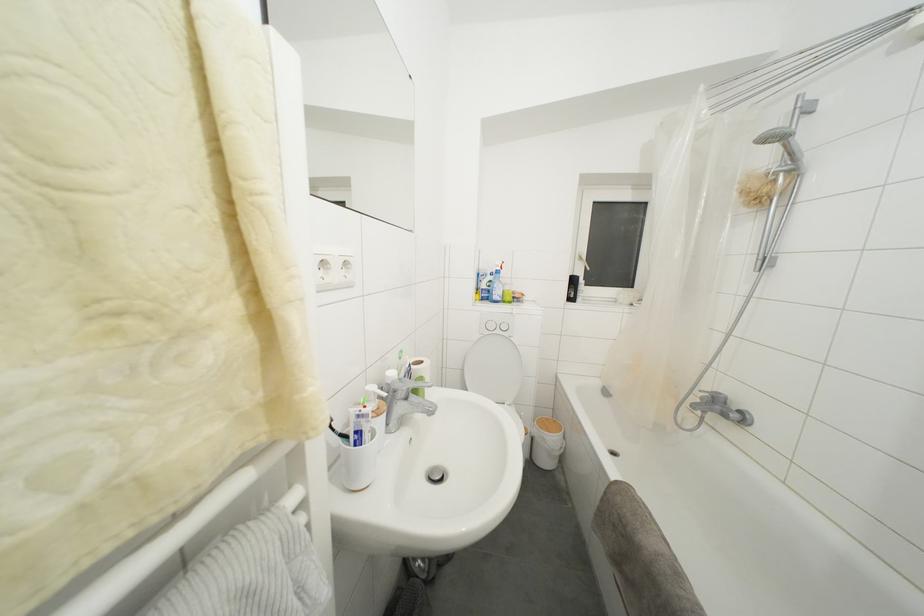
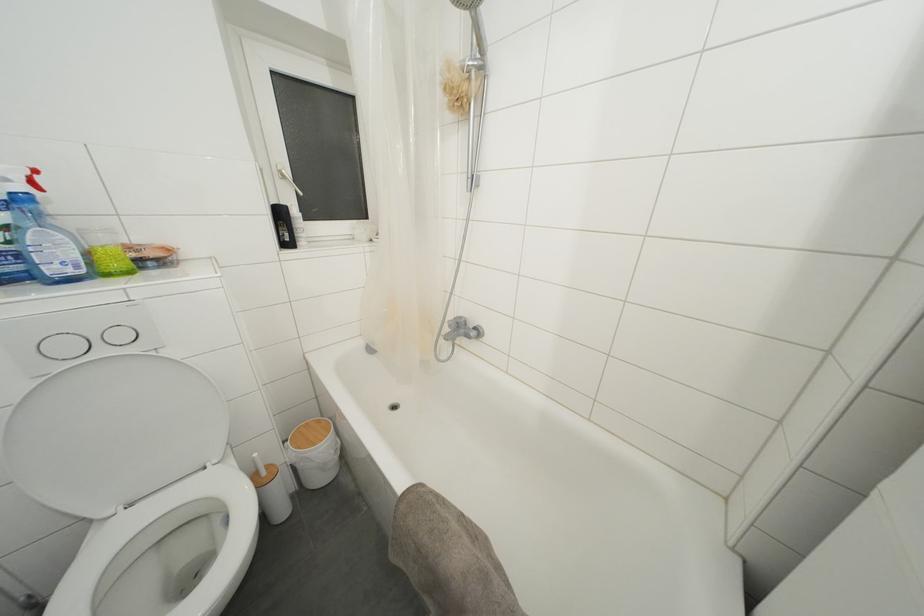
Find the pixel in the second image that matches the point at 495,331 in the first image.

(71, 352)